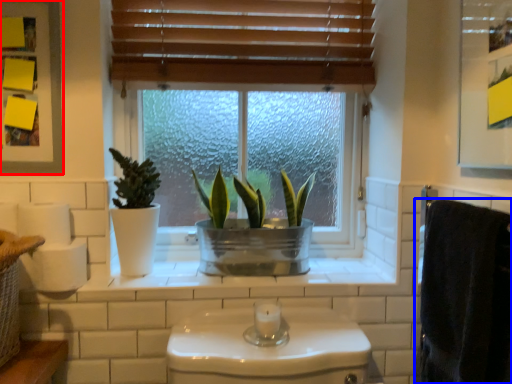
Question: Which object appears farthest to the camera in this image, medicine cabinet (highlighted by a red box) or bath towel (highlighted by a blue box)?

Choices:
 (A) medicine cabinet
 (B) bath towel

Answer: (A)